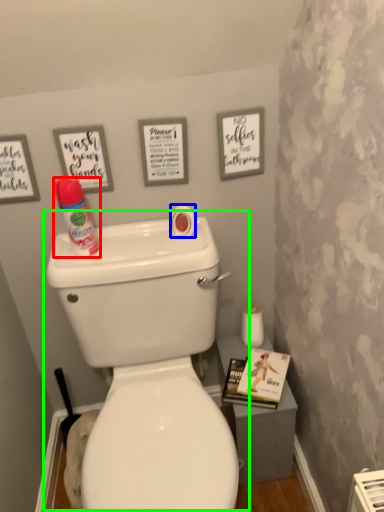
Question: Considering the real-world distances, which object is farthest from cleaning product (highlighted by a red box)? toilet paper (highlighted by a blue box) or toilet (highlighted by a green box)?

Choices:
 (A) toilet paper
 (B) toilet

Answer: (B)